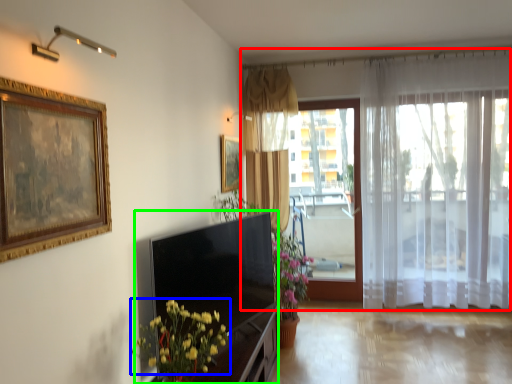
Question: Based on their relative distances, which object is farther from curtain (highlighted by a red box)? Choose from flower (highlighted by a blue box) and entertainment center (highlighted by a green box).

Choices:
 (A) flower
 (B) entertainment center

Answer: (A)